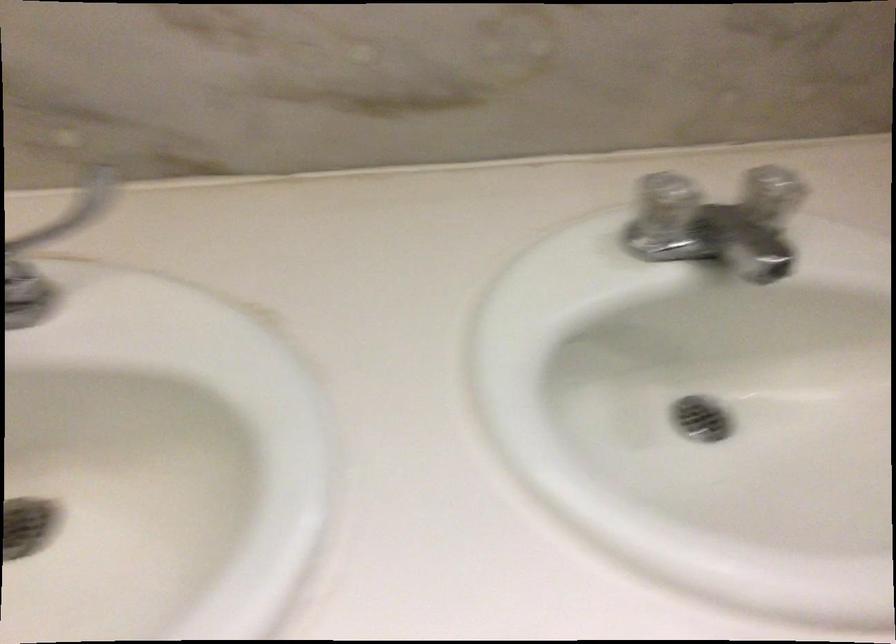
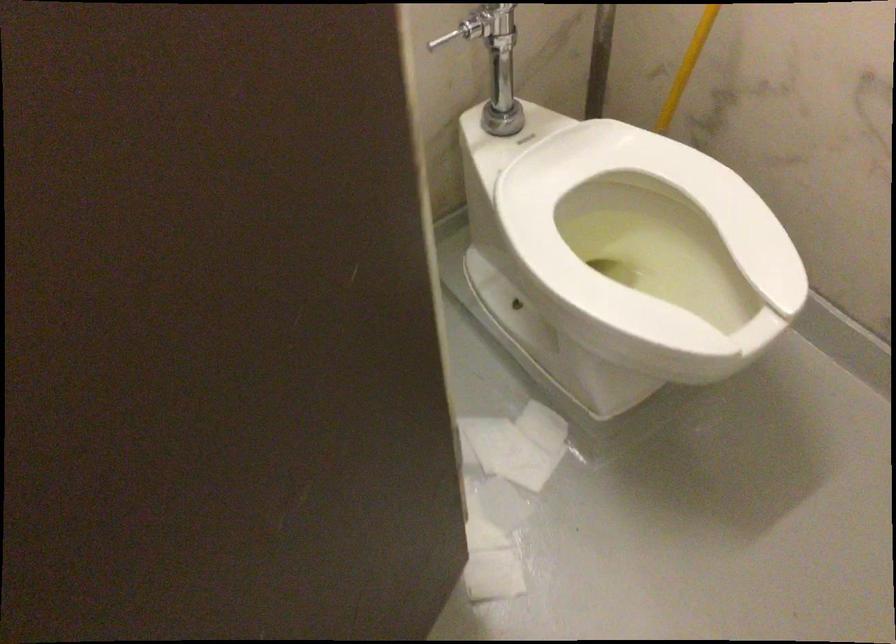
Question: The camera is either moving clockwise (left) or counter-clockwise (right) around the object. The first image is from the beginning of the video and the second image is from the end. Is the camera moving left or right when shooting the video?

Choices:
 (A) Left
 (B) Right

Answer: (A)